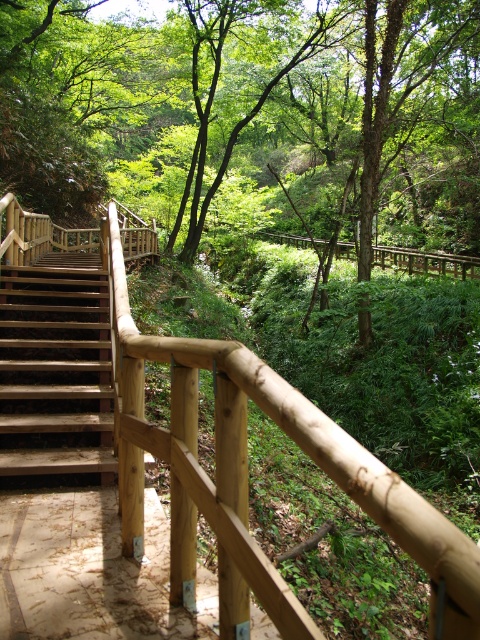
Can you confirm if brown wooden path at lower left is positioned to the left of wooden stairs at left?

In fact, brown wooden path at lower left is to the right of wooden stairs at left.

Which is below, brown wooden path at lower left or wooden stairs at left?

Positioned lower is brown wooden path at lower left.

Who is more forward, (22, 624) or (86, 388)?

Positioned in front is point (22, 624).

What are the coordinates of `brown wooden path at lower left` in the screenshot? It's located at (91, 572).

Is green matte tree at upper center taller than wooden stairs at left?

Yes, green matte tree at upper center is taller than wooden stairs at left.

Can you confirm if green matte tree at upper center is smaller than wooden stairs at left?

No, green matte tree at upper center is not smaller than wooden stairs at left.

Which is behind, point (120, 20) or point (23, 419)?

The point (120, 20) is more distant.

You are a GUI agent. You are given a task and a screenshot of the screen. Output one action in this format:
    pyautogui.click(x=<x>, y=<y>)
    Task: Click on the green matte tree at upper center
    The image size is (480, 640).
    Given the screenshot: What is the action you would take?
    pyautogui.click(x=252, y=109)

Can you confirm if natural wood handrail at center is positioned to the left of wooden stairs at left?

Incorrect, natural wood handrail at center is not on the left side of wooden stairs at left.

What do you see at coordinates (247, 474) in the screenshot? I see `natural wood handrail at center` at bounding box center [247, 474].

Locate an element on the screen. This screenshot has height=640, width=480. natural wood handrail at center is located at coordinates (247, 474).